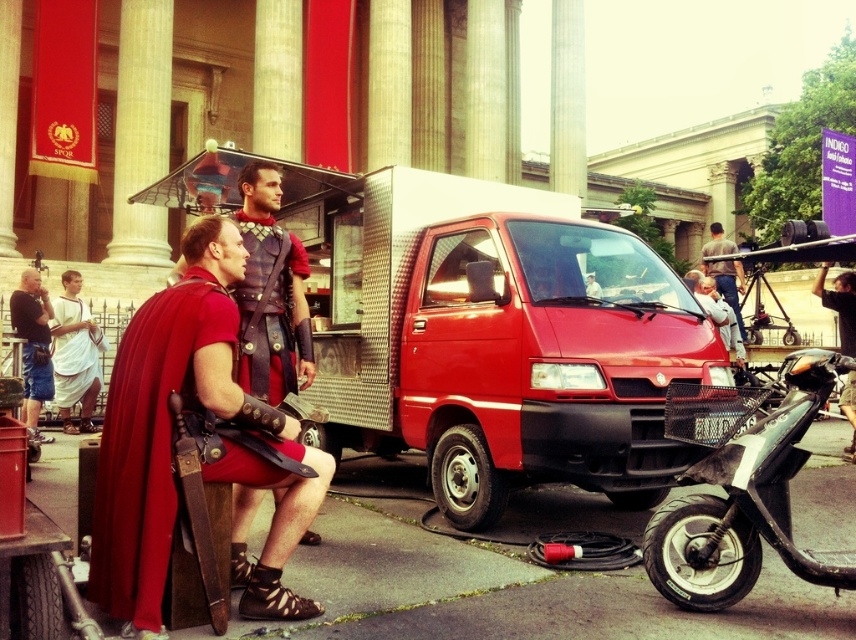
Between shiny black scooter at lower right and matte black helmet at upper center, which one is positioned lower?

Positioned lower is shiny black scooter at lower right.

Image resolution: width=856 pixels, height=640 pixels. What are the coordinates of `shiny black scooter at lower right` in the screenshot? It's located at (746, 502).

Locate an element on the screen. This screenshot has width=856, height=640. shiny black scooter at lower right is located at coordinates 746,502.

Between point (111, 545) and point (94, 376), which one is positioned in front?

Point (111, 545)

Can you confirm if matte red cape at center is thinner than white cotton toga at left?

No.

Does point (183, 362) come behind point (76, 300)?

No, (183, 362) is in front of (76, 300).

In order to click on matte red cape at center in this screenshot , I will do `click(171, 440)`.

Find the location of a particular element. shiny black scooter at lower right is located at coordinates coord(746,502).

Describe the element at coordinates (746, 502) in the screenshot. I see `shiny black scooter at lower right` at that location.

Does point (761, 444) come farther from viewer compared to point (49, 392)?

No, (761, 444) is in front of (49, 392).

Find the location of a particular element. This screenshot has width=856, height=640. shiny black scooter at lower right is located at coordinates (746, 502).